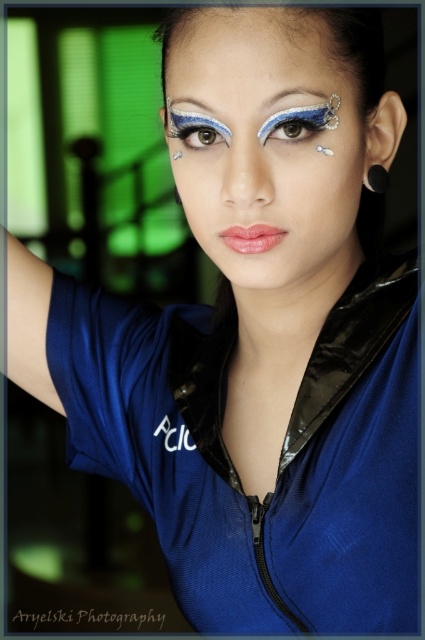
Question: Observing the image, what is the correct spatial positioning of shiny blue eye at center in reference to silver metallic earring at upper right?

Choices:
 (A) left
 (B) right

Answer: (A)

Question: Which object is positioned closest to the satin black eyebrow at upper center?

Choices:
 (A) shiny blue eye makeup at center
 (B) silver metallic earring at upper right
 (C) shiny blue eye at center
 (D) matte black eyebrow at upper center

Answer: (C)

Question: Which point is closer to the camera?

Choices:
 (A) shiny blue eye makeup at center
 (B) satin black eyebrow at upper center
 (C) silver metallic earring at upper right
 (D) blue glitter eye at center

Answer: (A)

Question: Estimate the real-world distances between objects in this image. Which object is closer to the shiny blue eye at center?

Choices:
 (A) satin black eyebrow at upper center
 (B) blue glitter eye at center

Answer: (B)

Question: Is blue glitter eye at center in front of matte black eyebrow at upper center?

Choices:
 (A) yes
 (B) no

Answer: (A)

Question: Does shiny blue eye makeup at center appear on the right side of silver metallic earring at upper right?

Choices:
 (A) yes
 (B) no

Answer: (B)